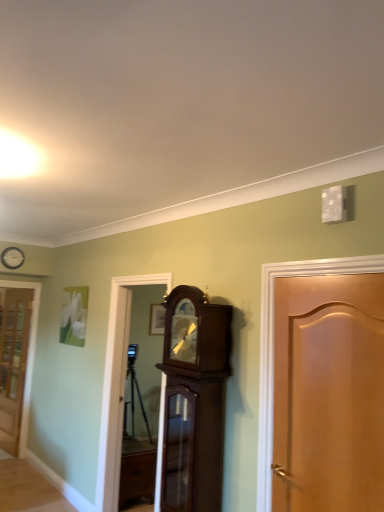
Question: Is wooden door at right, the 1th door from the right, taller or shorter than translucent glass door at left, positioned as the 1th door in left-to-right order?

Choices:
 (A) short
 (B) tall

Answer: (A)

Question: Considering their positions, is wooden door at right, the first door positioned from the front, located in front of or behind translucent glass door at left, which is counted as the 1th door, starting from the back?

Choices:
 (A) front
 (B) behind

Answer: (A)

Question: Which of these objects is positioned farthest from the white wooden clock at upper left?

Choices:
 (A) mahogany wood grandfather clock at center, which ranks as the second cabinetry in bottom-to-top order
 (B) wooden door at right, the 1th door from the right
 (C) translucent glass door at left, positioned as the 1th door in left-to-right order
 (D) brown wooden cabinet at center, the 2th cabinetry when ordered from top to bottom

Answer: (B)

Question: Which object is the farthest from the white wooden clock at upper left?

Choices:
 (A) brown wooden cabinet at center, the 2th cabinetry when ordered from top to bottom
 (B) translucent glass door at left, which is the second door from right to left
 (C) mahogany wood grandfather clock at center, which ranks as the second cabinetry in bottom-to-top order
 (D) wooden door at right, the 1th door from the right

Answer: (D)